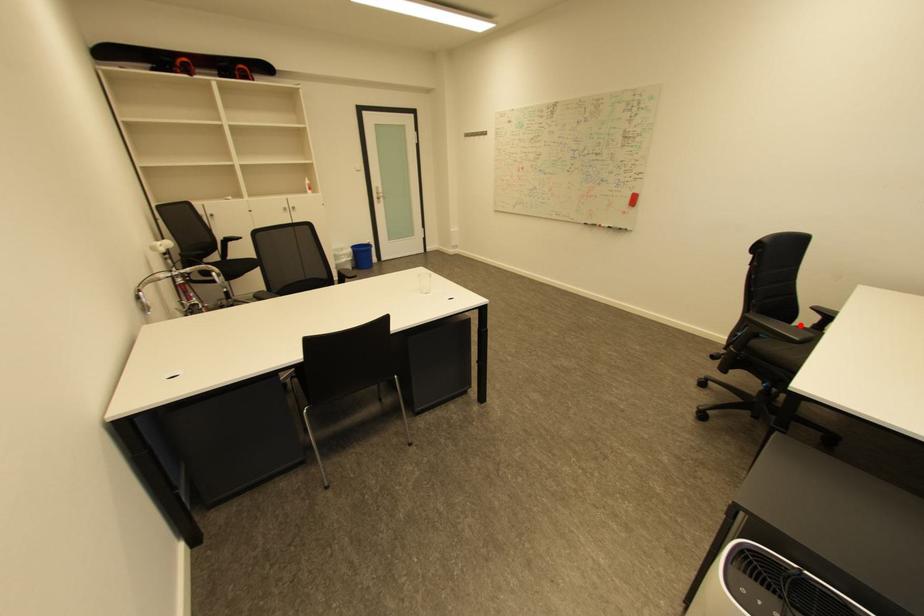
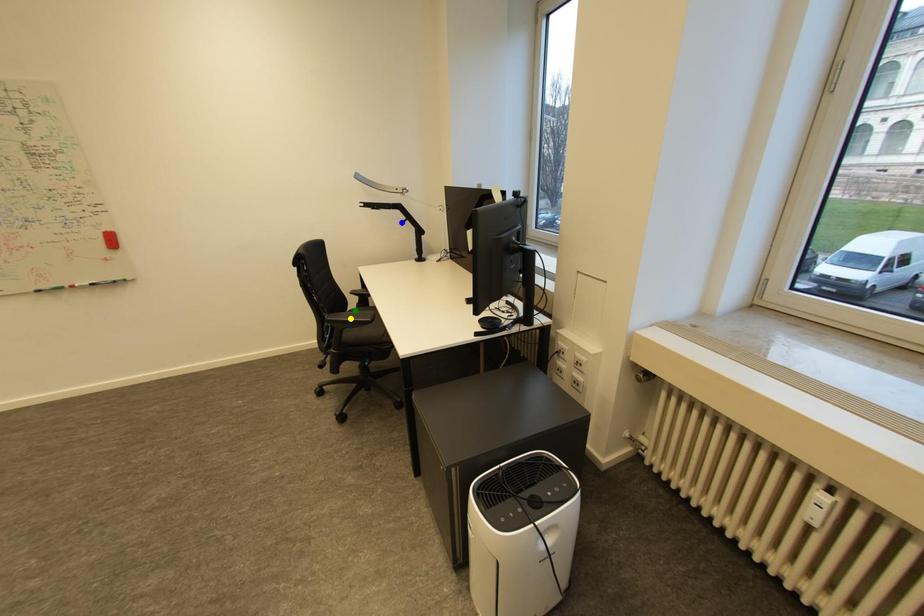
Question: I am providing you with two images of the same scene from different viewpoints. A red point is marked on the first image. You are given multiple points on the second image. Can you choose the point in image 2 that corresponds to the point in image 1?

Choices:
 (A) blue point
 (B) yellow point
 (C) green point

Answer: (C)